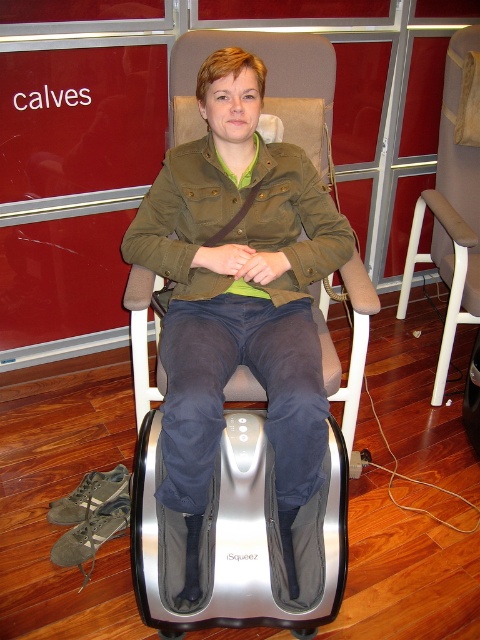
Is olive green fabric jacket at center in front of beige fabric swivel chair at center?

Yes, it is.

Which is behind, point (278, 452) or point (475, 157)?

The point (475, 157) is behind.

Who is more distant from viewer, (x=222, y=348) or (x=466, y=49)?

Positioned behind is point (x=466, y=49).

In order to click on olive green fabric jacket at center in this screenshot , I will do `click(239, 296)`.

Based on the photo, does olive green fabric jacket at center have a lesser width compared to olive green canvas jacket at center?

Yes.

Does point (143, 252) come farther from viewer compared to point (279, 246)?

No, (143, 252) is in front of (279, 246).

I want to click on olive green fabric jacket at center, so click(239, 296).

Is olive green canvas jacket at center above beige fabric swivel chair at center?

No, olive green canvas jacket at center is not above beige fabric swivel chair at center.

Can you confirm if olive green canvas jacket at center is positioned below beige fabric swivel chair at center?

Yes.

The height and width of the screenshot is (640, 480). Describe the element at coordinates (240, 221) in the screenshot. I see `olive green canvas jacket at center` at that location.

Where is `olive green canvas jacket at center`? The image size is (480, 640). olive green canvas jacket at center is located at coordinates (240, 221).